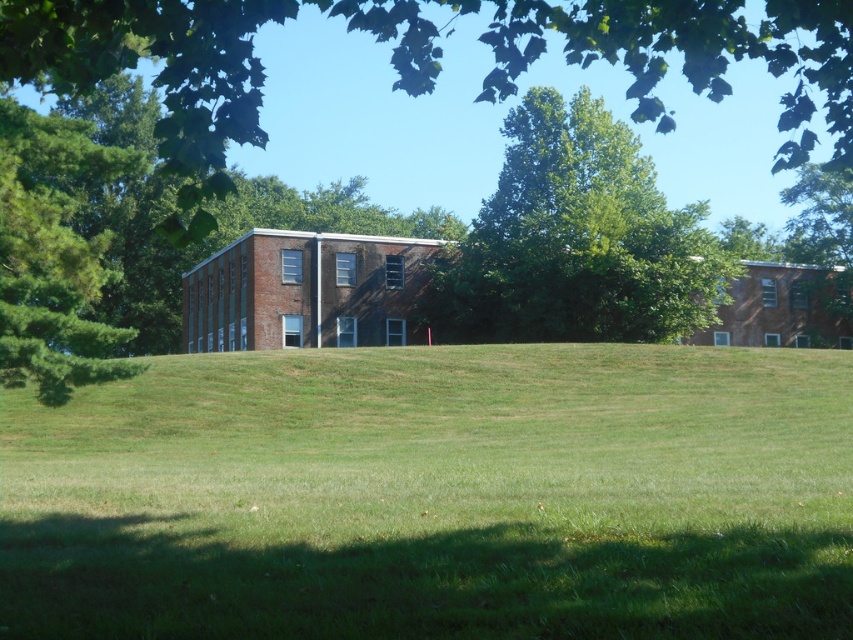
Question: Observing the image, what is the correct spatial positioning of green leafy tree at upper center in reference to green leafy tree at center?

Choices:
 (A) right
 (B) left

Answer: (B)

Question: Is green grass at center to the left of green leafy tree at center from the viewer's perspective?

Choices:
 (A) no
 (B) yes

Answer: (B)

Question: Which point is farther from the camera taking this photo?

Choices:
 (A) (636, 236)
 (B) (596, 605)

Answer: (A)

Question: Does green leafy tree at center lie in front of green pine tree at left?

Choices:
 (A) no
 (B) yes

Answer: (A)

Question: Among these points, which one is nearest to the camera?

Choices:
 (A) (614, 280)
 (B) (57, 198)
 (C) (698, 81)

Answer: (C)

Question: Considering the real-world distances, which object is closest to the green leafy tree at upper center?

Choices:
 (A) green leafy tree at center
 (B) green grass at center
 (C) green pine tree at left

Answer: (A)